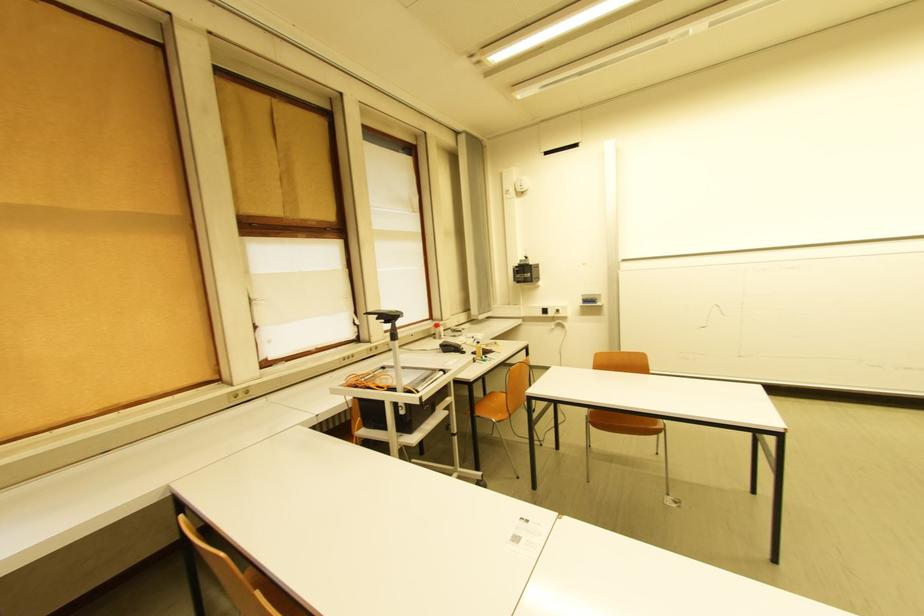
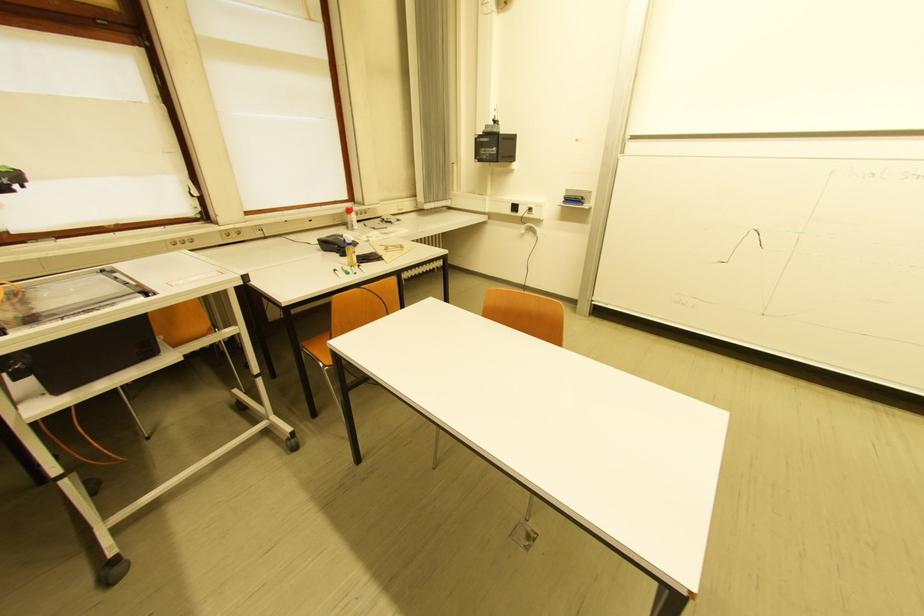
In the second image, find the point that corresponds to (x=591, y=302) in the first image.

(575, 201)